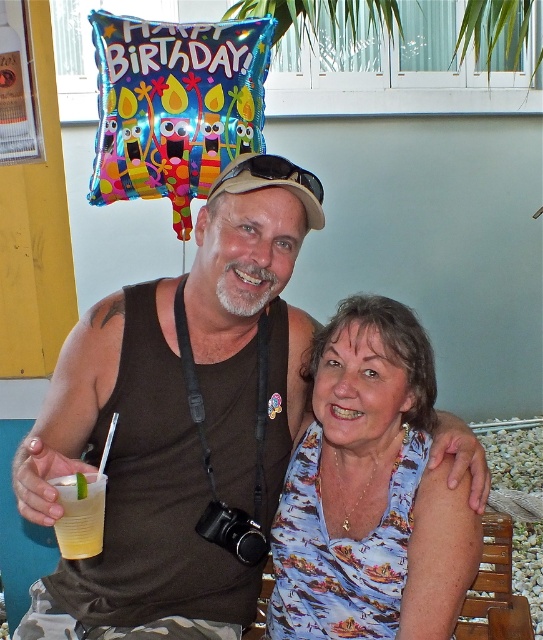
Question: Among these objects, which one is farthest from the camera?

Choices:
 (A) brown fabric tank top at center
 (B) yellow translucent cup at lower left

Answer: (B)

Question: Does brown fabric tank top at center appear over printed fabric blouse at center?

Choices:
 (A) no
 (B) yes

Answer: (B)

Question: Which of the following is the closest to the observer?

Choices:
 (A) (67, 493)
 (B) (332, 536)

Answer: (A)

Question: Observing the image, what is the correct spatial positioning of brown fabric tank top at center in reference to printed fabric blouse at center?

Choices:
 (A) above
 (B) below

Answer: (A)

Question: Is brown fabric tank top at center thinner than printed fabric blouse at center?

Choices:
 (A) yes
 (B) no

Answer: (B)

Question: Which of these objects is positioned closest to the yellow translucent cup at lower left?

Choices:
 (A) brown fabric tank top at center
 (B) printed fabric blouse at center

Answer: (A)